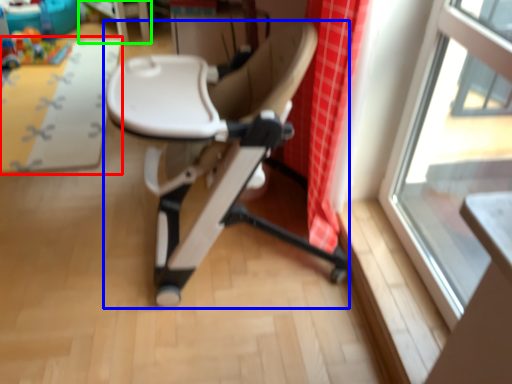
Question: Which object is positioned closest to mat (highlighted by a red box)? Select from chair (highlighted by a blue box) and table (highlighted by a green box).

Choices:
 (A) chair
 (B) table

Answer: (B)